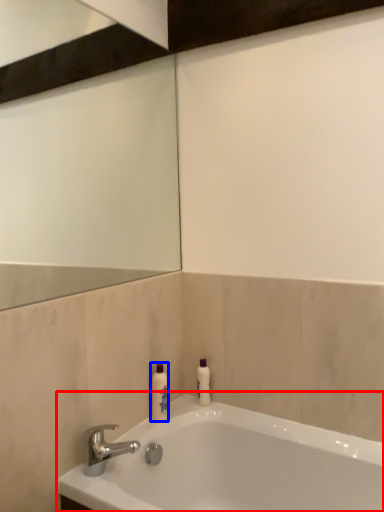
Question: Which point is further to the camera, bathtub (highlighted by a red box) or toiletry (highlighted by a blue box)?

Choices:
 (A) bathtub
 (B) toiletry

Answer: (B)